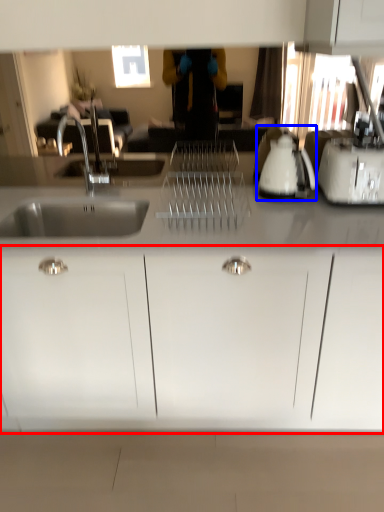
Question: Which of the following is the farthest to the observer, cabinetry (highlighted by a red box) or appliance (highlighted by a blue box)?

Choices:
 (A) cabinetry
 (B) appliance

Answer: (B)